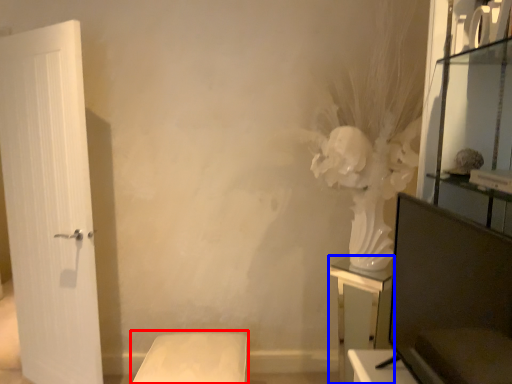
Question: Which object appears closest to the camera in this image, furniture (highlighted by a red box) or furniture (highlighted by a blue box)?

Choices:
 (A) furniture
 (B) furniture

Answer: (A)